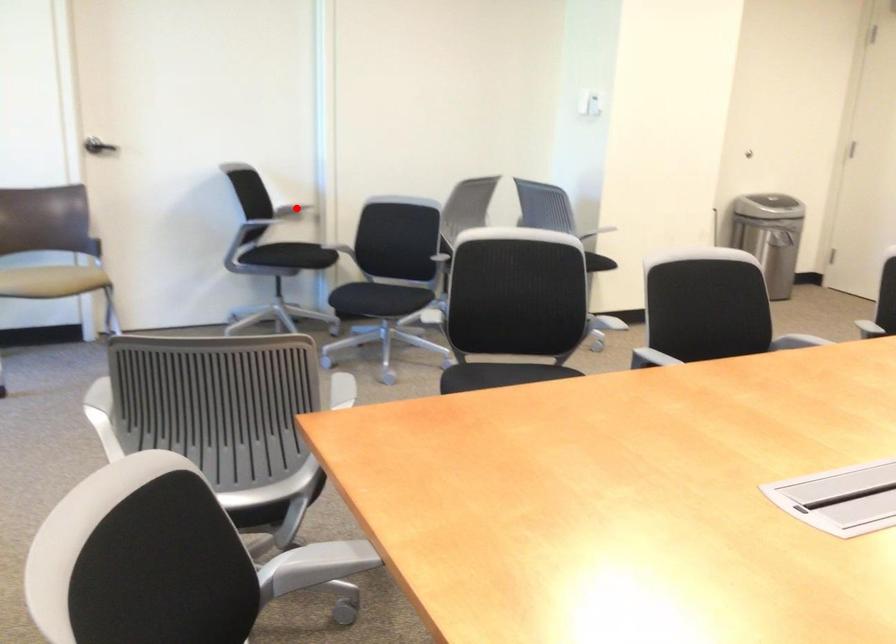
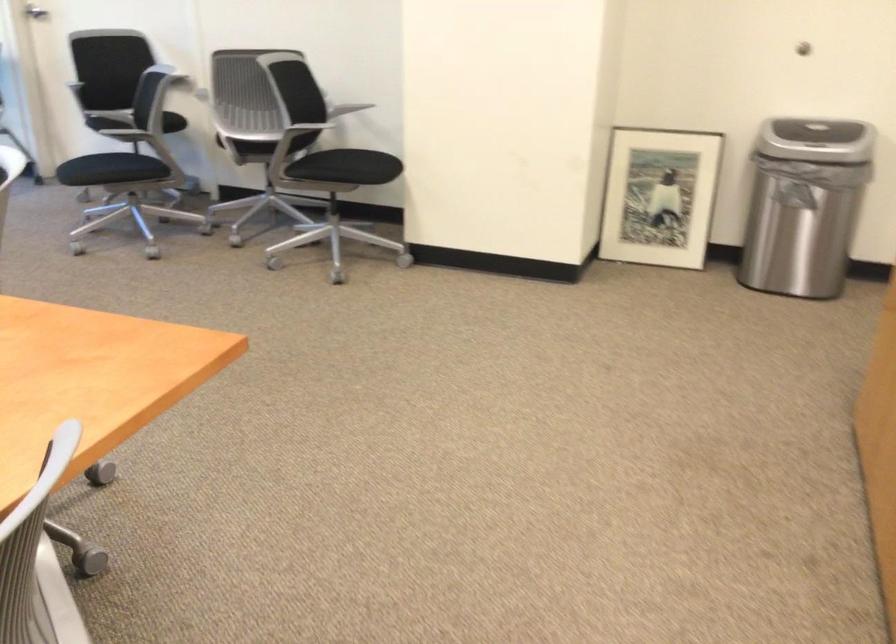
Question: I am providing you with two images of the same scene from different viewpoints. A red point is marked on the first image. Can you still see the location of the red point in image 2?

Choices:
 (A) Yes
 (B) No

Answer: (B)